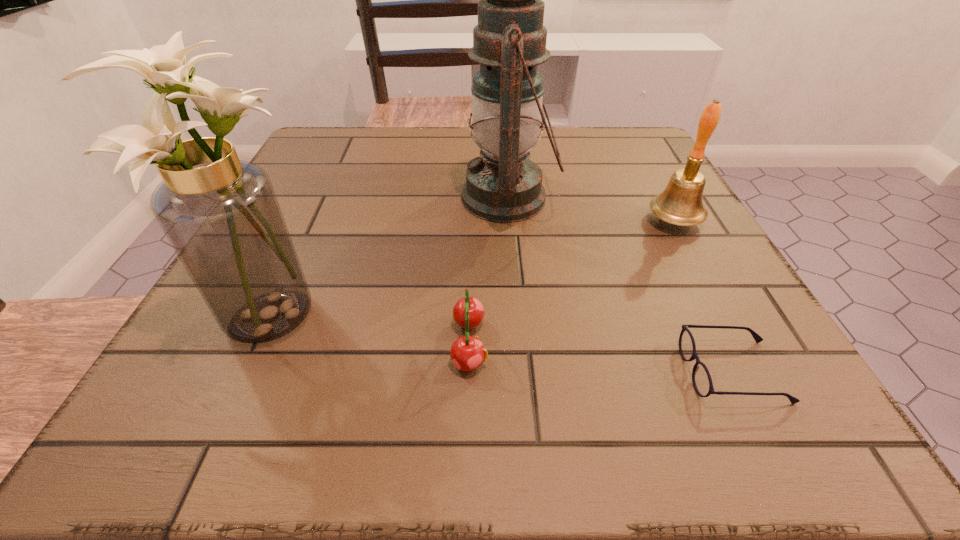
Find the location of a particular element. This screenshot has height=540, width=960. free space at the left edge of the desktop is located at coordinates (335, 195).

The image size is (960, 540). In order to click on free spot at the right edge of the desktop in this screenshot , I will do `click(745, 372)`.

This screenshot has width=960, height=540. I want to click on free region at the far left corner of the desktop, so click(x=325, y=130).

In the image, there is a desktop. At what (x,y) coordinates should I click in order to perform the action: click on free space at the near left corner. Please return your answer as a coordinate pair (x, y). This screenshot has width=960, height=540. Looking at the image, I should click on (273, 382).

Find the location of `free space between the shortest object and the oil lamp`. free space between the shortest object and the oil lamp is located at coordinates (620, 285).

I want to click on empty space between the spectacles and the bell, so click(x=704, y=296).

At what (x,y) coordinates should I click in order to perform the action: click on empty location between the bell and the leftmost object. Please return your answer as a coordinate pair (x, y). This screenshot has width=960, height=540. Looking at the image, I should click on (471, 267).

This screenshot has height=540, width=960. Identify the location of free space that is in between the second shortest object and the third shortest object. (572, 282).

Image resolution: width=960 pixels, height=540 pixels. Find the location of `unoccupied position between the flower arrangement and the bell`. unoccupied position between the flower arrangement and the bell is located at coordinates (471, 267).

Where is `unoccupied position between the oil lamp and the spectacles`? unoccupied position between the oil lamp and the spectacles is located at coordinates (620, 285).